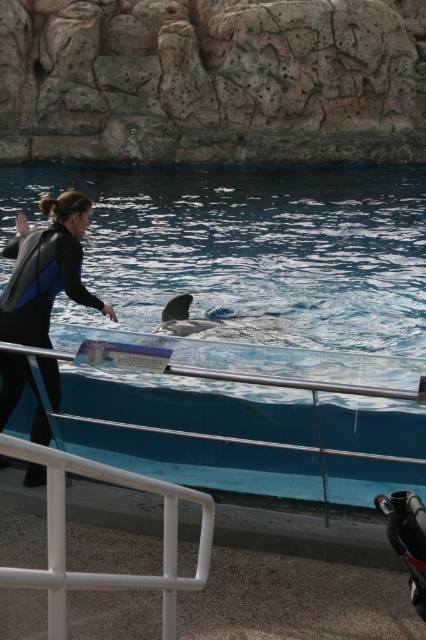
Does point (218, 353) come farther from viewer compared to point (207, 323)?

No, (218, 353) is closer to viewer.

Is metal/rail at lower center smaller than white smooth dolphin at center?

Actually, metal/rail at lower center might be larger than white smooth dolphin at center.

Who is more forward, (271,448) or (181,314)?

Positioned in front is point (271,448).

The width and height of the screenshot is (426, 640). I want to click on metal/rail at lower center, so click(249, 420).

Can you confirm if black matte wetsuit at left is smaller than white smooth dolphin at center?

Incorrect, black matte wetsuit at left is not smaller in size than white smooth dolphin at center.

Who is more distant from viewer, (42, 472) or (192, 330)?

The point (192, 330) is more distant.

Does point (42, 204) come closer to viewer compared to point (198, 332)?

Yes.

You are a GUI agent. You are given a task and a screenshot of the screen. Output one action in this format:
    pyautogui.click(x=<x>, y=<y>)
    Task: Click on the black matte wetsuit at left
    This screenshot has height=640, width=426.
    Given the screenshot: What is the action you would take?
    pyautogui.click(x=45, y=275)

From the picture: Can you confirm if white plastic rail at lower left is positioned below black matte wetsuit at left?

Correct, white plastic rail at lower left is located below black matte wetsuit at left.

Who is taller, white plastic rail at lower left or black matte wetsuit at left?

black matte wetsuit at left

Image resolution: width=426 pixels, height=640 pixels. In order to click on white plastic rail at lower left in this screenshot , I will do `click(106, 573)`.